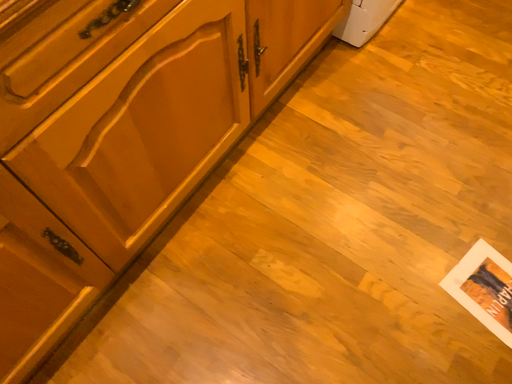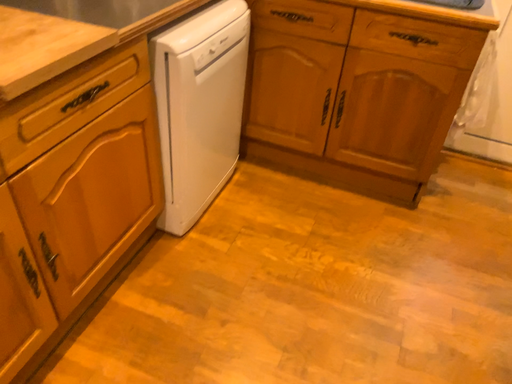
Question: How did the camera likely rotate when shooting the video?

Choices:
 (A) rotated upward
 (B) rotated downward

Answer: (A)